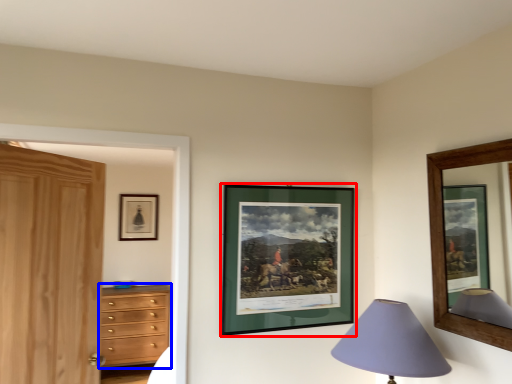
Question: Which object appears closest to the camera in this image, picture frame (highlighted by a red box) or chest of drawers (highlighted by a blue box)?

Choices:
 (A) picture frame
 (B) chest of drawers

Answer: (A)